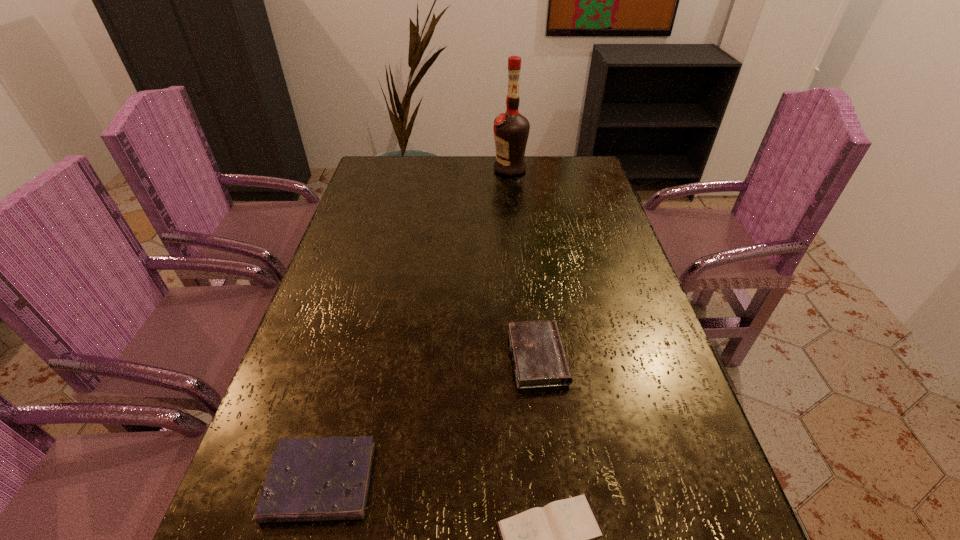
Locate an element on the screen. This screenshot has width=960, height=540. unoccupied position between the farthest object and the second shortest object is located at coordinates (415, 325).

Image resolution: width=960 pixels, height=540 pixels. Find the location of `free area in between the third shortest object and the second shortest object`. free area in between the third shortest object and the second shortest object is located at coordinates (429, 420).

Locate which object is the third closest to the second shortest diary. Please provide its 2D coordinates. Your answer should be formatted as a tuple, i.e. [(x, y)], where the tuple contains the x and y coordinates of a point satisfying the conditions above.

[(511, 129)]

Image resolution: width=960 pixels, height=540 pixels. In order to click on the third closest object to the leftmost object in this screenshot , I will do `click(511, 129)`.

Choose which diary is the nearest neighbor to the tallest object. Please provide its 2D coordinates. Your answer should be formatted as a tuple, i.e. [(x, y)], where the tuple contains the x and y coordinates of a point satisfying the conditions above.

[(539, 358)]

Identify which diary is the closest to the shortest diary. Please provide its 2D coordinates. Your answer should be formatted as a tuple, i.e. [(x, y)], where the tuple contains the x and y coordinates of a point satisfying the conditions above.

[(539, 358)]

Find the location of a particular element. Image resolution: width=960 pixels, height=540 pixels. free space that satisfies the following two spatial constraints: 1. on the front and back of the farthest object; 2. on the back side of the farthest diary is located at coordinates (529, 357).

You are a GUI agent. You are given a task and a screenshot of the screen. Output one action in this format:
    pyautogui.click(x=<x>, y=<y>)
    Task: Click on the free region that satisfies the following two spatial constraints: 1. on the back side of the third nearest object; 2. on the right side of the leftmost diary
    
    Given the screenshot: What is the action you would take?
    pyautogui.click(x=353, y=357)